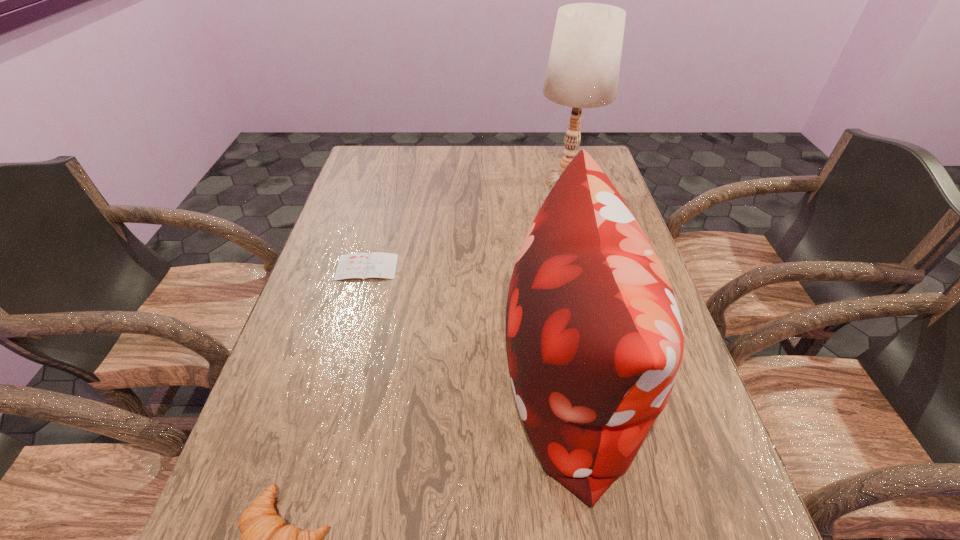
At what (x,y) coordinates should I click in order to perform the action: click on lamp. Please return your answer as a coordinate pair (x, y). The width and height of the screenshot is (960, 540). Looking at the image, I should click on (583, 69).

Where is `the tallest object`? The image size is (960, 540). the tallest object is located at coordinates (583, 69).

This screenshot has width=960, height=540. I want to click on cushion, so click(594, 339).

The image size is (960, 540). Identify the location of diary. (377, 264).

Where is `the third nearest object`? the third nearest object is located at coordinates (377, 264).

I want to click on vacant space situated on the front of the tallest object, so click(x=590, y=272).

This screenshot has width=960, height=540. What are the coordinates of `vacant space situated on the front-facing side of the cushion` in the screenshot? It's located at (399, 387).

Where is `free point located 0.190m on the front-facing side of the cushion`? free point located 0.190m on the front-facing side of the cushion is located at coordinates (409, 387).

At what (x,y) coordinates should I click in order to perform the action: click on vacant area situated on the front-facing side of the cushion. Please return your answer as a coordinate pair (x, y). Looking at the image, I should click on (439, 387).

You are a GUI agent. You are given a task and a screenshot of the screen. Output one action in this format:
    pyautogui.click(x=<x>, y=<y>)
    Task: Click on the vacant space situated 0.270m on the right of the shortest object
    Image resolution: width=960 pixels, height=540 pixels.
    Given the screenshot: What is the action you would take?
    pyautogui.click(x=499, y=267)